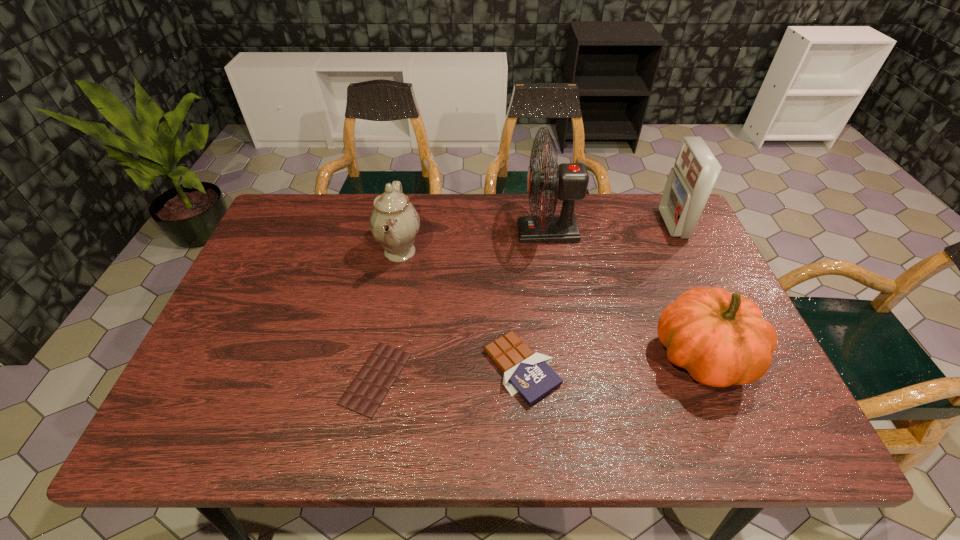
Locate an element on the screen. The height and width of the screenshot is (540, 960). vacant point located on the front-facing side of the fan is located at coordinates (407, 232).

You are a GUI agent. You are given a task and a screenshot of the screen. Output one action in this format:
    pyautogui.click(x=<x>, y=<y>)
    Task: Click on the vacant area situated 0.110m on the front-facing side of the first-aid kit
    The width and height of the screenshot is (960, 540).
    Given the screenshot: What is the action you would take?
    pyautogui.click(x=629, y=224)

At what (x,y) coordinates should I click in order to perform the action: click on blank space located 0.290m on the front-facing side of the first-aid kit. Please return your answer as a coordinate pair (x, y). Looking at the image, I should click on (571, 224).

Where is `free space located on the front-facing side of the first-aid kit`? Image resolution: width=960 pixels, height=540 pixels. free space located on the front-facing side of the first-aid kit is located at coordinates pos(610,224).

Locate an element on the screen. Image resolution: width=960 pixels, height=540 pixels. free space located on the spout of the chinaware is located at coordinates (474, 252).

Where is `vacant region located 0.400m on the back of the pumpkin`? The image size is (960, 540). vacant region located 0.400m on the back of the pumpkin is located at coordinates (645, 219).

Locate an element on the screen. free space located 0.120m on the left of the right chocolate bar is located at coordinates (431, 368).

Identify the location of vacant space positioned 0.220m on the left of the left chocolate bar. (x=246, y=379).

The width and height of the screenshot is (960, 540). In order to click on fan positioned at the far edge in this screenshot , I will do `click(569, 182)`.

In order to click on the first-aid kit at the far edge in this screenshot , I will do `click(690, 182)`.